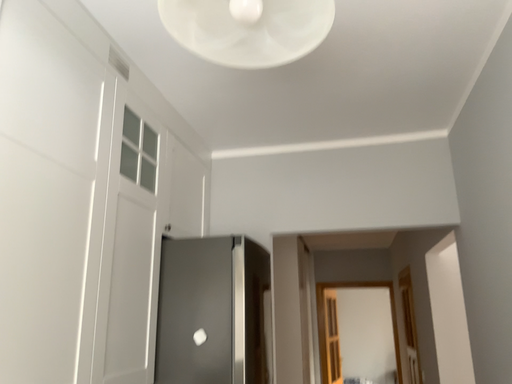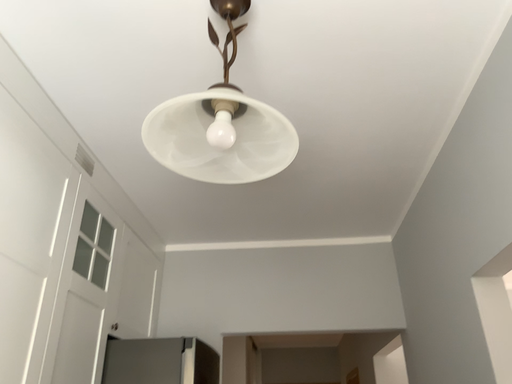
Question: Which way did the camera rotate in the video?

Choices:
 (A) rotated upward
 (B) rotated downward

Answer: (A)